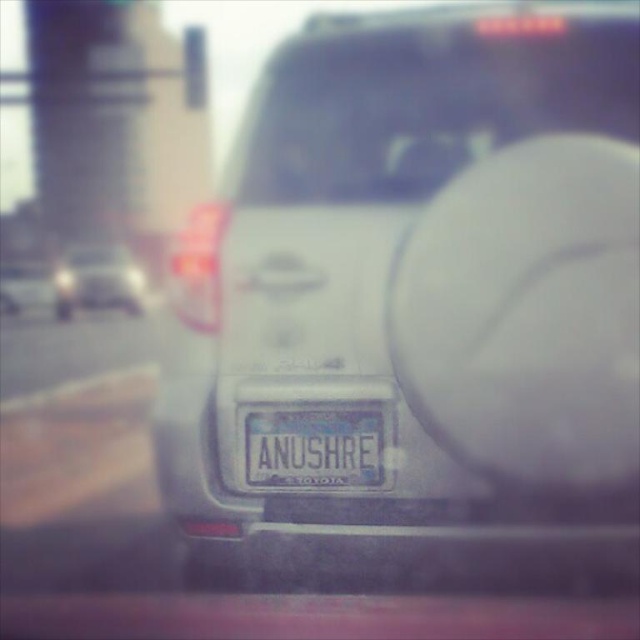
You are a passenger in the car and want to check the rearview mirror and windshield for any obstructions. Which object, the white glossy rearview mirror at center or the transparent glass windshield at center, is taller?

The white glossy rearview mirror at center is taller than the transparent glass windshield at center according to the description.

You are a passenger in a car and notice two items through the window. The satin silver suv at center and the white metallic license plate at center. Which one is closer to your viewpoint?

The satin silver suv at center is closer to your viewpoint because it is positioned in front of the white metallic license plate at center.